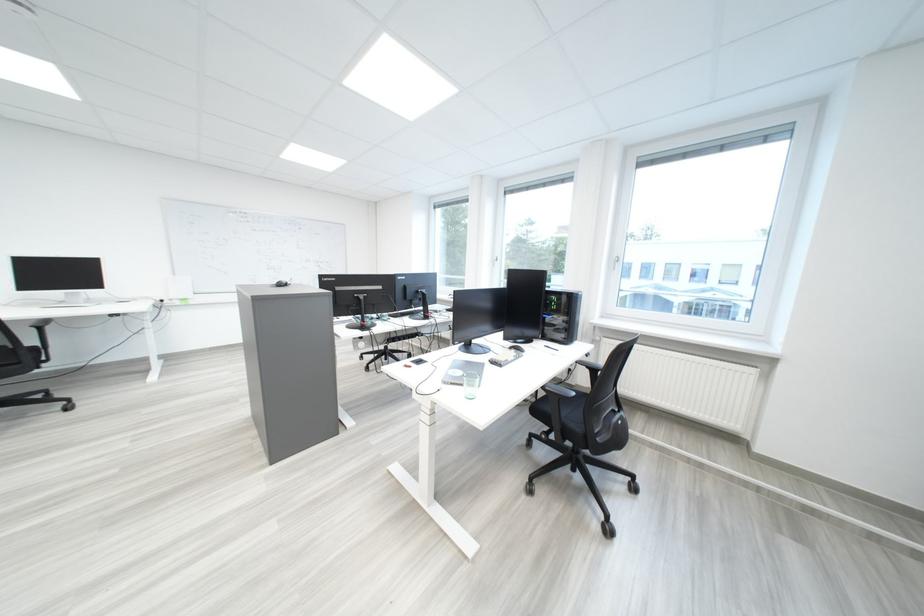
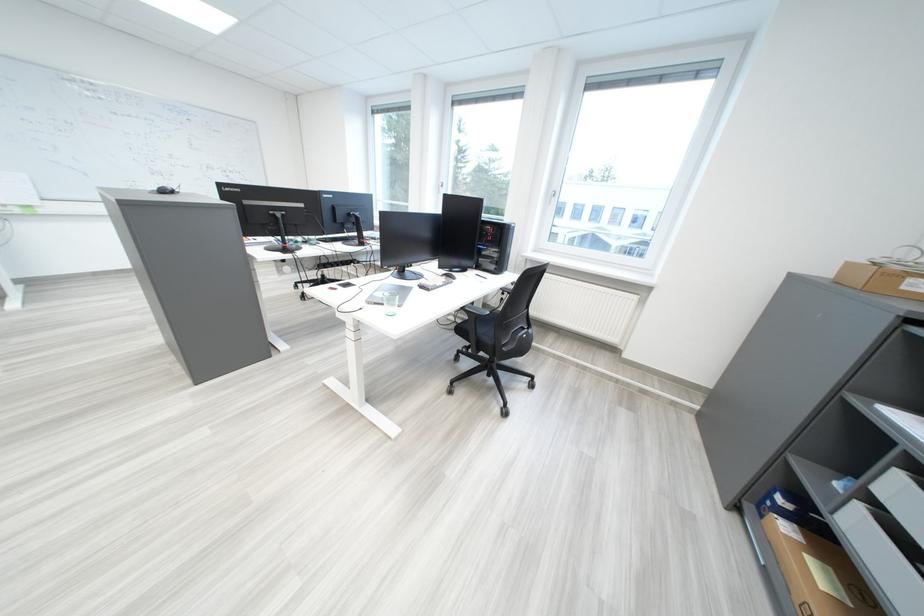
Find the pixel in the second image that matches pixel 481 387 in the first image.

(402, 305)